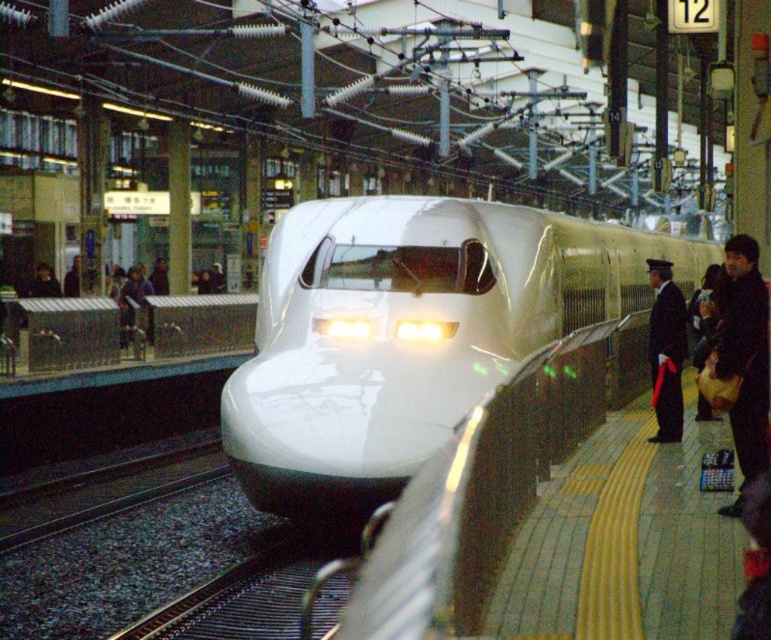
Does white glossy bullet train at center have a greater width compared to dark blue uniform at right?

Indeed, white glossy bullet train at center has a greater width compared to dark blue uniform at right.

Who is positioned more to the left, white glossy bullet train at center or dark blue uniform at right?

Positioned to the left is white glossy bullet train at center.

Does point (273, 490) come behind point (667, 317)?

That is False.

This screenshot has height=640, width=771. I want to click on white glossy bullet train at center, so click(409, 333).

Is dark gray fabric jacket at right bigger than dark blue uniform at right?

Indeed, dark gray fabric jacket at right has a larger size compared to dark blue uniform at right.

Which of these two, dark gray fabric jacket at right or dark blue uniform at right, stands taller?

dark gray fabric jacket at right is taller.

What do you see at coordinates (743, 358) in the screenshot? This screenshot has height=640, width=771. I see `dark gray fabric jacket at right` at bounding box center [743, 358].

Locate an element on the screen. The image size is (771, 640). dark gray fabric jacket at right is located at coordinates (743, 358).

Does white glossy bullet train at center have a lesser height compared to dark gray fabric jacket at right?

No, white glossy bullet train at center is not shorter than dark gray fabric jacket at right.

Based on the photo, who is more forward, (406, 472) or (732, 412)?

Point (732, 412)

Where is `white glossy bullet train at center`? The height and width of the screenshot is (640, 771). white glossy bullet train at center is located at coordinates (409, 333).